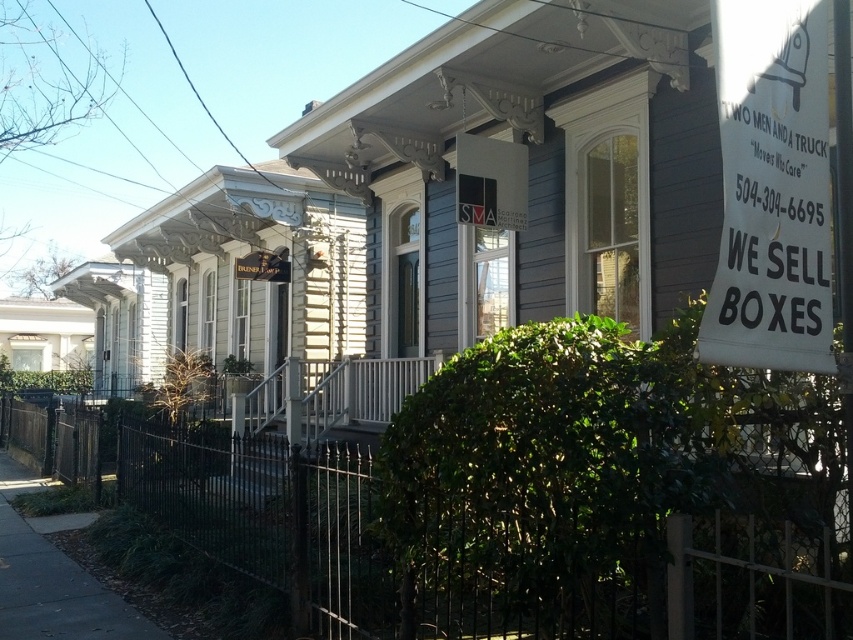
Question: Which point is farther to the camera?

Choices:
 (A) dark gray asphalt at lower left
 (B) white paper sign at right

Answer: (A)

Question: Which of the following is the closest to the observer?

Choices:
 (A) (792, 122)
 (B) (10, 625)

Answer: (A)

Question: In this image, where is white paper sign at right located relative to dark gray asphalt at lower left?

Choices:
 (A) right
 (B) left

Answer: (A)

Question: In this image, where is white paper sign at right located relative to dark gray asphalt at lower left?

Choices:
 (A) right
 (B) left

Answer: (A)

Question: Does white paper sign at right appear on the right side of dark gray asphalt at lower left?

Choices:
 (A) yes
 (B) no

Answer: (A)

Question: Which point appears closest to the camera in this image?

Choices:
 (A) (799, 365)
 (B) (44, 481)

Answer: (A)